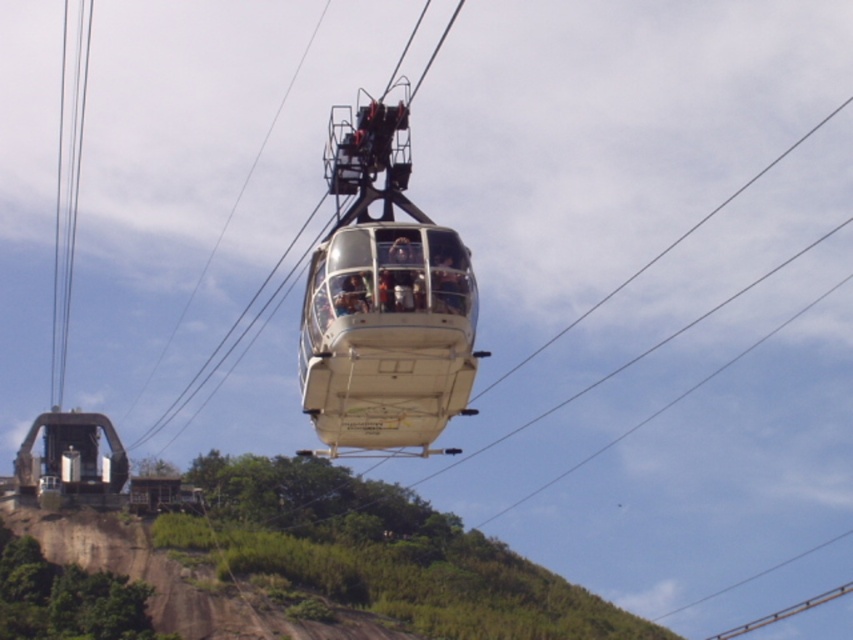
You are a maintenance worker needing to inspect the clear glass cables at upper left while standing on the white glossy cable car at center. Given that your inspection tool has a maximum reach of 130 meters, can you safely perform the inspection without moving the cable car?

The distance between the white glossy cable car at center and the clear glass cables at upper left is 132.44 meters, which exceeds the tool reach of 130 meters. Therefore, you cannot safely inspect the clear glass cables at upper left from the white glossy cable car at center without moving it.

You are a tourist standing on the ground looking up at the cable car system. You notice the white glossy cable car at center and the clear glass cables at upper left. Which object appears bigger in your view?

The white glossy cable car at center appears bigger in your view because it has a larger size compared to the clear glass cables at upper left.